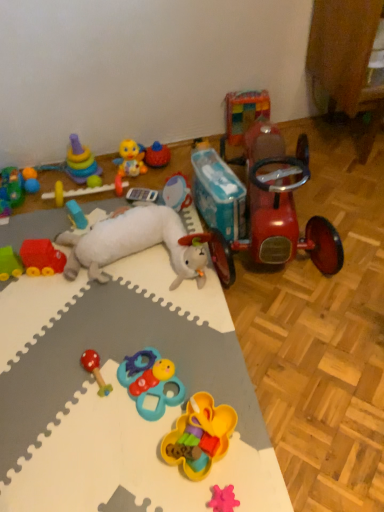
Locate an element on the screen. The width and height of the screenshot is (384, 512). vacant area that lies to the right of shiny red tricycle at right, which is counted as the 1th toy, starting from the right is located at coordinates (347, 211).